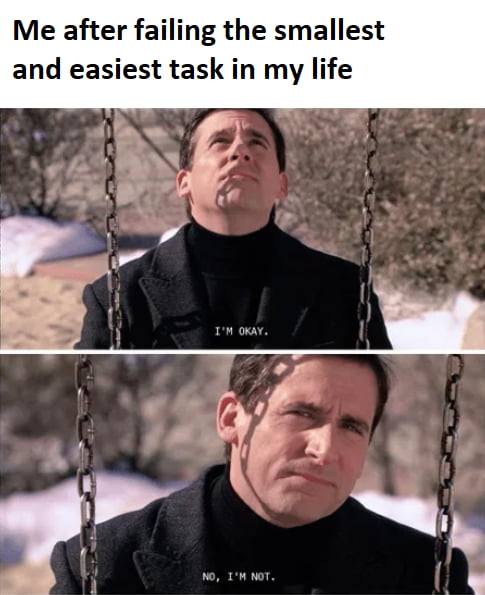
Identify the location of coat. (208, 541), (185, 287).